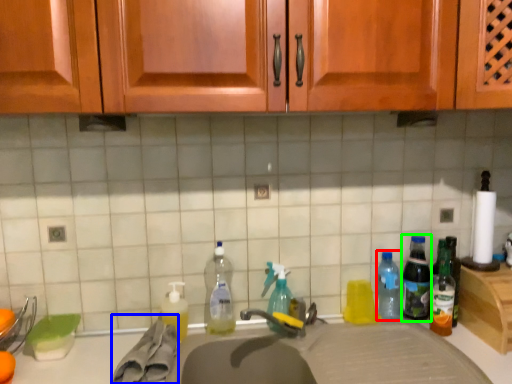
Question: Which is farther away from bottle (highlighted by a red box)? material (highlighted by a blue box) or bottle (highlighted by a green box)?

Choices:
 (A) material
 (B) bottle

Answer: (A)